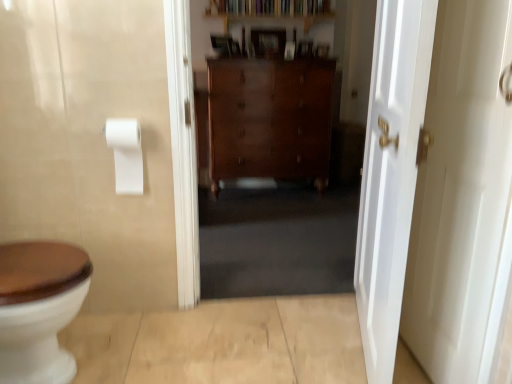
This screenshot has width=512, height=384. I want to click on white glossy door at right, arranged as the first door when viewed from the left, so click(x=390, y=173).

Locate an element on the screen. polished wood dresser at center is located at coordinates (270, 119).

At what (x,y) coordinates should I click in order to perform the action: click on white glossy door at right, which appears as the 2th door when viewed from the left. Please return your answer as a coordinate pair (x, y). Looking at the image, I should click on (464, 200).

At what (x,y) coordinates should I click in order to perform the action: click on white glossy door at right, positioned as the 2th door in right-to-left order. Please return your answer as a coordinate pair (x, y). The height and width of the screenshot is (384, 512). Looking at the image, I should click on (390, 173).

In the scene shown: Can you see polished wood dresser at center touching white glossy door at right, acting as the first door starting from the right?

No, polished wood dresser at center is not beside white glossy door at right, acting as the first door starting from the right.

From a real-world perspective, which is physically below, polished wood dresser at center or white glossy door at right, which appears as the 2th door when viewed from the left?

polished wood dresser at center, from a real-world perspective.

From the image's perspective, which is above, polished wood dresser at center or white glossy door at right, acting as the first door starting from the right?

From the image's view, polished wood dresser at center is above.

In the image, is polished wood dresser at center on the left side or the right side of white glossy door at right, acting as the first door starting from the right?

Clearly, polished wood dresser at center is on the left of white glossy door at right, acting as the first door starting from the right, in the image.

Considering the relative positions of white glossy door at right, which appears as the 2th door when viewed from the left, and white matte toilet paper at upper left in the image provided, is white glossy door at right, which appears as the 2th door when viewed from the left, in front of white matte toilet paper at upper left?

Yes, white glossy door at right, which appears as the 2th door when viewed from the left, is in front of white matte toilet paper at upper left.

Which door is the 2nd one when counting from the front of the white matte toilet paper at upper left? Please provide its 2D coordinates.

[(464, 200)]

Does white glossy door at right, acting as the first door starting from the right, have a smaller size compared to white matte toilet paper at upper left?

No.

Is white glossy door at right, which appears as the 2th door when viewed from the left, not close to white matte toilet paper at upper left?

Indeed, white glossy door at right, which appears as the 2th door when viewed from the left, is not near white matte toilet paper at upper left.

Which of these two, wooden bookshelf at upper center or white glossy door at right, which appears as the 2th door when viewed from the left, is thinner?

Thinner between the two is white glossy door at right, which appears as the 2th door when viewed from the left.

Which is behind, point (321, 14) or point (508, 176)?

The point (321, 14) is behind.

Considering the relative sizes of polished wood dresser at center and white glossy door at right, arranged as the first door when viewed from the left, in the image provided, is polished wood dresser at center shorter than white glossy door at right, arranged as the first door when viewed from the left,?

Indeed, polished wood dresser at center has a lesser height compared to white glossy door at right, arranged as the first door when viewed from the left.

In terms of size, does polished wood dresser at center appear bigger or smaller than white glossy door at right, arranged as the first door when viewed from the left?

Clearly, polished wood dresser at center is larger in size than white glossy door at right, arranged as the first door when viewed from the left.

In the scene shown: From the image's perspective, which is above, polished wood dresser at center or white glossy door at right, arranged as the first door when viewed from the left?

polished wood dresser at center is shown above in the image.

Which of these two, white matte toilet paper at upper left or white glossy door at right, arranged as the first door when viewed from the left, is smaller?

white matte toilet paper at upper left.

From the picture: From the image's perspective, which is above, white matte toilet paper at upper left or white glossy door at right, arranged as the first door when viewed from the left?

white matte toilet paper at upper left, from the image's perspective.

The height and width of the screenshot is (384, 512). I want to click on the 1st door located beneath the white matte toilet paper at upper left (from a real-world perspective), so click(x=390, y=173).

Is white matte toilet paper at upper left taller or shorter than white glossy door at right, arranged as the first door when viewed from the left?

In the image, white matte toilet paper at upper left appears to be shorter than white glossy door at right, arranged as the first door when viewed from the left.

Measure the distance from white matte toilet paper at upper left to polished wood dresser at center.

1.83 meters.

What's the angular difference between white matte toilet paper at upper left and polished wood dresser at center's facing directions?

white matte toilet paper at upper left and polished wood dresser at center are facing 0.744 degrees away from each other.

Which is in front, white matte toilet paper at upper left or polished wood dresser at center?

Positioned in front is white matte toilet paper at upper left.

Considering the positions of point (128, 191) and point (220, 76), is point (128, 191) closer or farther from the camera than point (220, 76)?

Point (128, 191) is positioned closer to the camera compared to point (220, 76).

Is the position of white glossy door at right, acting as the first door starting from the right, more distant than that of polished wood dresser at center?

No, white glossy door at right, acting as the first door starting from the right, is closer to the viewer.

Could you tell me if white glossy door at right, which appears as the 2th door when viewed from the left, is facing polished wood dresser at center?

No, white glossy door at right, which appears as the 2th door when viewed from the left, does not turn towards polished wood dresser at center.

Which point is more distant from viewer, (473, 121) or (227, 130)?

The point (227, 130) is farther from the camera.

How distant is white glossy door at right, which appears as the 2th door when viewed from the left, from polished wood dresser at center?

2.15 meters.

Locate an element on the screen. The height and width of the screenshot is (384, 512). cabinetry lying on the left of white glossy door at right, acting as the first door starting from the right is located at coordinates (270, 119).

Locate an element on the screen. to paper towel lying above the white glossy door at right, acting as the first door starting from the right (from the image's perspective) is located at coordinates (126, 154).

From the picture: Considering their positions, is wooden bookshelf at upper center positioned further to white glossy door at right, arranged as the first door when viewed from the left, than polished wood dresser at center?

wooden bookshelf at upper center is further to white glossy door at right, arranged as the first door when viewed from the left.

When comparing their distances from white glossy door at right, arranged as the first door when viewed from the left, does white glossy door at right, acting as the first door starting from the right, or polished wood dresser at center seem closer?

white glossy door at right, acting as the first door starting from the right, is positioned closer to the anchor white glossy door at right, arranged as the first door when viewed from the left.

Based on their spatial positions, is wooden bookshelf at upper center or white matte toilet paper at upper left further from polished wood dresser at center?

Among the two, white matte toilet paper at upper left is located further to polished wood dresser at center.

When comparing their distances from white glossy door at right, positioned as the 2th door in right-to-left order, does polished wood dresser at center or wooden bookshelf at upper center seem closer?

The object closer to white glossy door at right, positioned as the 2th door in right-to-left order, is polished wood dresser at center.

Based on their spatial positions, is white matte toilet paper at upper left or polished wood dresser at center further from wooden bookshelf at upper center?

Among the two, white matte toilet paper at upper left is located further to wooden bookshelf at upper center.

From the picture: Considering their positions, is white matte toilet paper at upper left positioned further to white glossy door at right, arranged as the first door when viewed from the left, than wooden bookshelf at upper center?

wooden bookshelf at upper center is positioned further to the anchor white glossy door at right, arranged as the first door when viewed from the left.

When comparing their distances from polished wood dresser at center, does white matte toilet paper at upper left or wooden bookshelf at upper center seem closer?

wooden bookshelf at upper center.

Estimate the real-world distances between objects in this image. Which object is closer to white glossy door at right, which appears as the 2th door when viewed from the left, white glossy door at right, arranged as the first door when viewed from the left, or white matte toilet paper at upper left?

white glossy door at right, arranged as the first door when viewed from the left.

What are the coordinates of `door located between white matte toilet paper at upper left and white glossy door at right, which appears as the 2th door when viewed from the left, in the left-right direction` in the screenshot? It's located at (390, 173).

Where is `cabinetry positioned between white glossy door at right, positioned as the 2th door in right-to-left order, and wooden bookshelf at upper center from near to far`? The width and height of the screenshot is (512, 384). cabinetry positioned between white glossy door at right, positioned as the 2th door in right-to-left order, and wooden bookshelf at upper center from near to far is located at coordinates (270, 119).

At what (x,y) coordinates should I click in order to perform the action: click on door between white glossy door at right, acting as the first door starting from the right, and wooden bookshelf at upper center in the front-back direction. Please return your answer as a coordinate pair (x, y). The height and width of the screenshot is (384, 512). Looking at the image, I should click on (390, 173).

Identify the location of cabinetry between white matte toilet paper at upper left and wooden bookshelf at upper center along the z-axis. The image size is (512, 384). (270, 119).